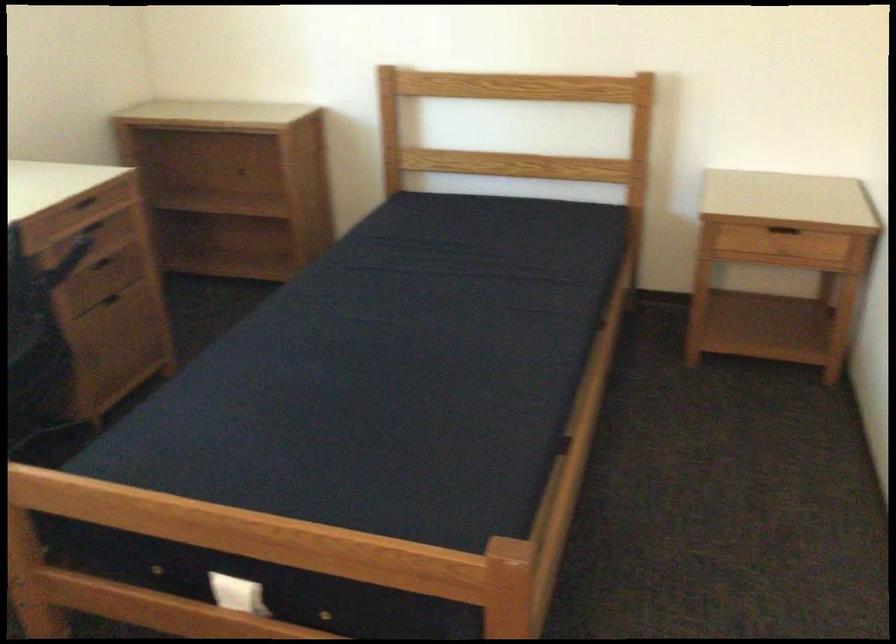
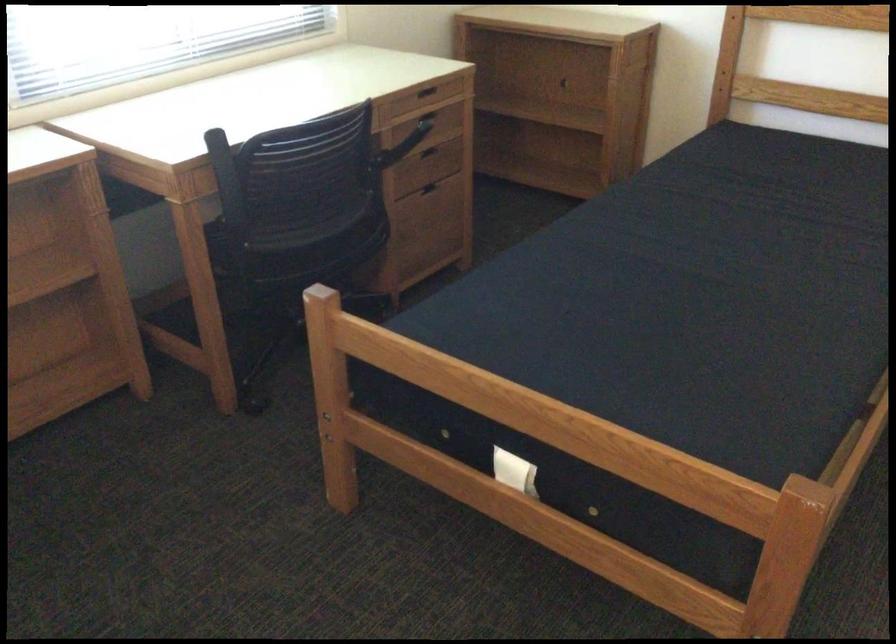
In the second image, find the point that corresponds to the point at 116,305 in the first image.

(434, 192)